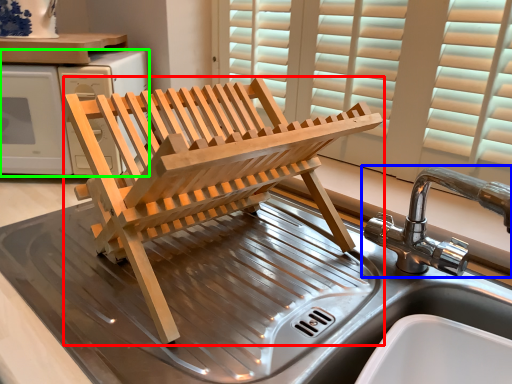
Question: Estimate the real-world distances between objects in this image. Which object is farther from furniture (highlighted by a red box), tap (highlighted by a blue box) or appliance (highlighted by a green box)?

Choices:
 (A) tap
 (B) appliance

Answer: (A)